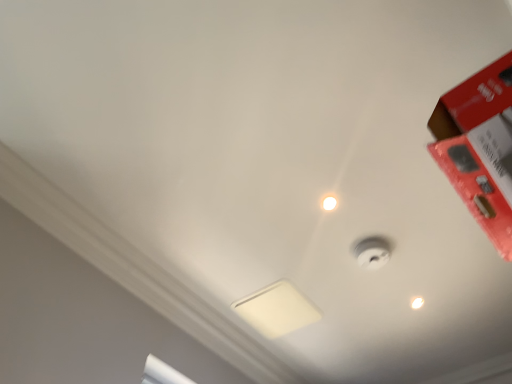
Question: Considering the relative positions of red matte box at upper right and white glossy droplight at upper center in the image provided, is red matte box at upper right to the left of white glossy droplight at upper center from the viewer's perspective?

Choices:
 (A) yes
 (B) no

Answer: (B)

Question: Is red matte box at upper right thinner than white glossy droplight at upper center?

Choices:
 (A) yes
 (B) no

Answer: (B)

Question: Does red matte box at upper right have a greater width compared to white glossy droplight at upper center?

Choices:
 (A) yes
 (B) no

Answer: (A)

Question: From the image's perspective, is red matte box at upper right located beneath white glossy droplight at upper center?

Choices:
 (A) no
 (B) yes

Answer: (A)

Question: Is red matte box at upper right further to camera compared to white glossy droplight at upper center?

Choices:
 (A) yes
 (B) no

Answer: (B)

Question: From the image's perspective, would you say red matte box at upper right is positioned over white glossy droplight at upper center?

Choices:
 (A) no
 (B) yes

Answer: (B)

Question: Does white glossy light bulb at upper center have a larger size compared to white matte lamp at center?

Choices:
 (A) yes
 (B) no

Answer: (B)

Question: Can you confirm if white glossy light bulb at upper center is shorter than white matte lamp at center?

Choices:
 (A) yes
 (B) no

Answer: (B)

Question: Is the depth of white glossy light bulb at upper center greater than that of white matte lamp at center?

Choices:
 (A) no
 (B) yes

Answer: (B)

Question: Does white glossy light bulb at upper center have a smaller size compared to white matte lamp at center?

Choices:
 (A) no
 (B) yes

Answer: (B)

Question: Is white glossy light bulb at upper center at the left side of white matte lamp at center?

Choices:
 (A) no
 (B) yes

Answer: (A)

Question: From a real-world perspective, is white glossy light bulb at upper center over white matte lamp at center?

Choices:
 (A) yes
 (B) no

Answer: (B)

Question: Considering the relative sizes of white matte lamp at center and white glossy light bulb at upper center in the image provided, is white matte lamp at center taller than white glossy light bulb at upper center?

Choices:
 (A) yes
 (B) no

Answer: (B)